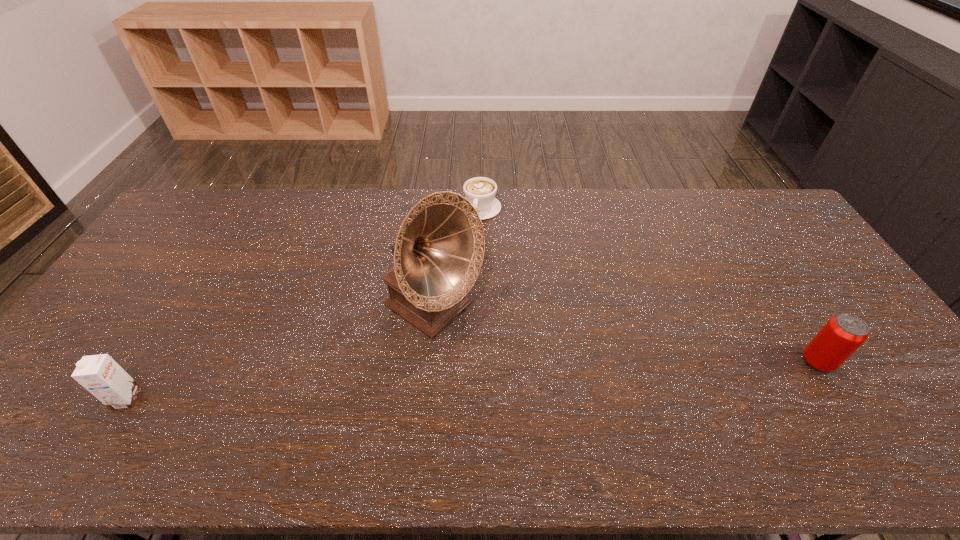
Where is `free space on the desktop that is between the leftmost object and the can and is positioned on the horn of the tallest object`? This screenshot has height=540, width=960. free space on the desktop that is between the leftmost object and the can and is positioned on the horn of the tallest object is located at coordinates (532, 377).

You are a GUI agent. You are given a task and a screenshot of the screen. Output one action in this format:
    pyautogui.click(x=<x>, y=<y>)
    Task: Click on the vacant spot on the desktop that is between the leftmost object and the can and is positioned to the right of the farthest object's handle
    
    Given the screenshot: What is the action you would take?
    tap(427, 383)